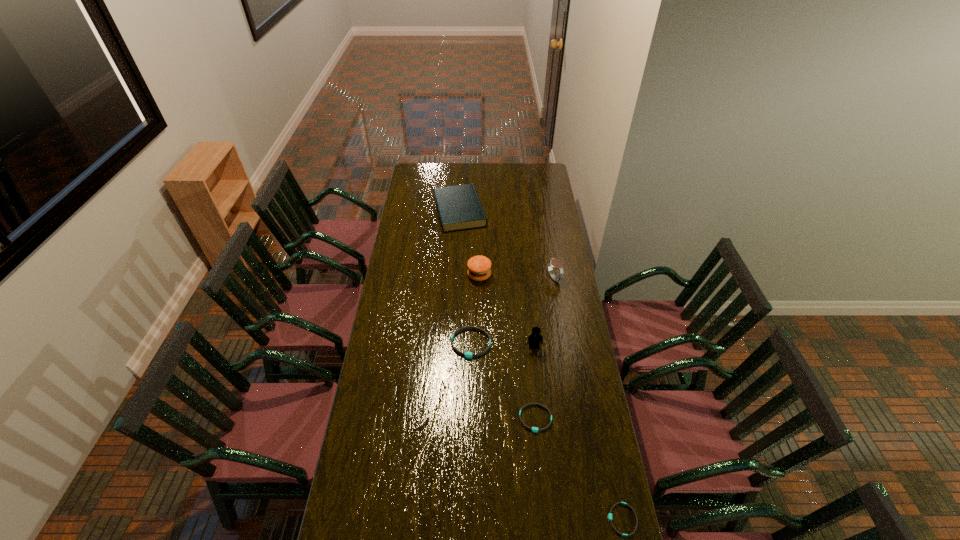
This screenshot has height=540, width=960. Identify the location of the farthest wristband. (469, 355).

Locate an element on the screen. This screenshot has width=960, height=540. the leftmost wristband is located at coordinates (469, 355).

Find the location of a particular element. the second farthest wristband is located at coordinates (534, 429).

At what (x,y) coordinates should I click in order to perform the action: click on the second wristband from right to left. Please return your answer as a coordinate pair (x, y). This screenshot has width=960, height=540. Looking at the image, I should click on (534, 429).

Image resolution: width=960 pixels, height=540 pixels. Find the location of `the rightmost object`. the rightmost object is located at coordinates (610, 514).

This screenshot has width=960, height=540. Find the location of `the shortest object`. the shortest object is located at coordinates (610, 514).

Identify the location of patty. Image resolution: width=960 pixels, height=540 pixels. (479, 267).

At what (x,y) coordinates should I click in order to perform the action: click on book. Please return your answer as a coordinate pair (x, y). This screenshot has width=960, height=540. Looking at the image, I should click on (459, 207).

Where is `the farthest object`? This screenshot has height=540, width=960. the farthest object is located at coordinates (459, 207).

Locate an element on the screen. The width and height of the screenshot is (960, 540). the sixth object from left to right is located at coordinates (553, 262).